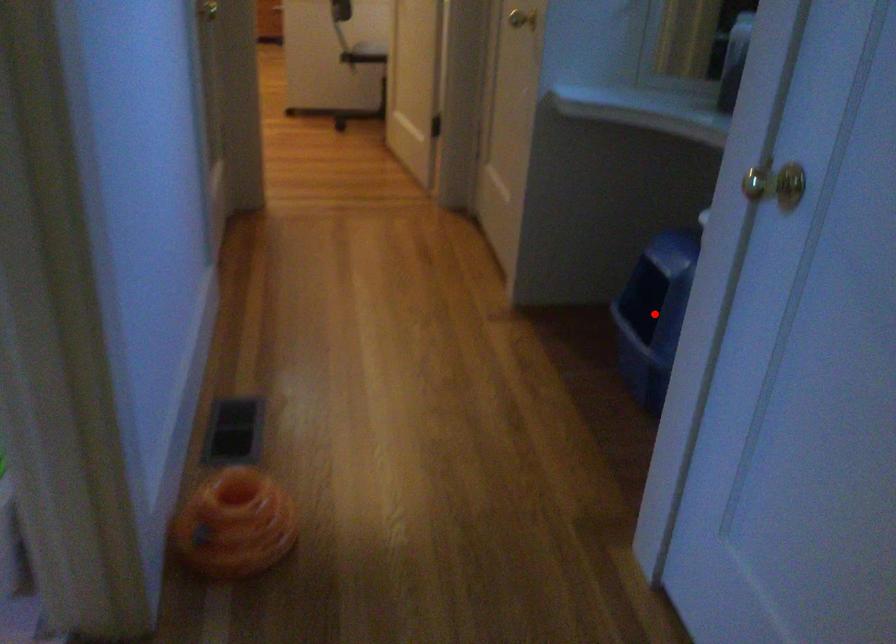
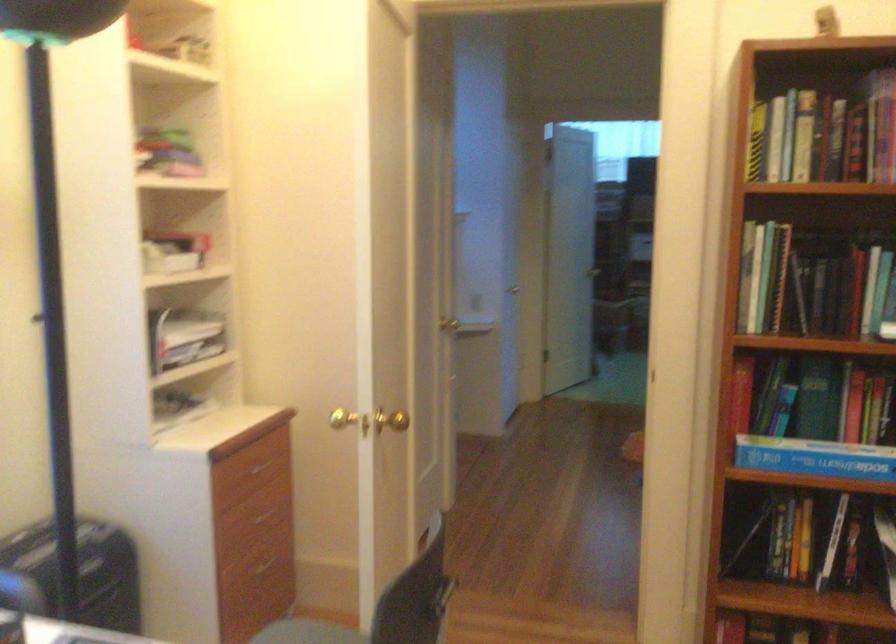
Question: I am providing you with two images of the same scene from different viewpoints. A red point is marked on the first image. At the location where the point appears in image 1, is it still visible in image 2?

Choices:
 (A) Yes
 (B) No

Answer: (B)